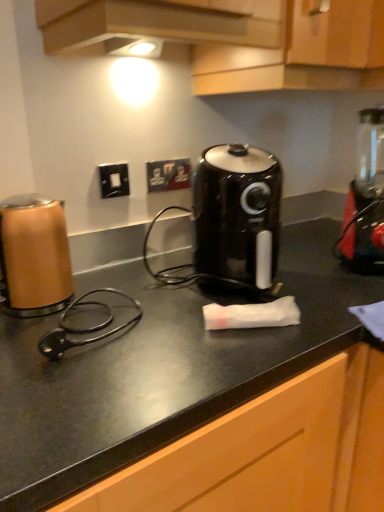
Where is `vacant space situated above black matte countertop at center (from a real-world perspective)`? vacant space situated above black matte countertop at center (from a real-world perspective) is located at coordinates (196, 305).